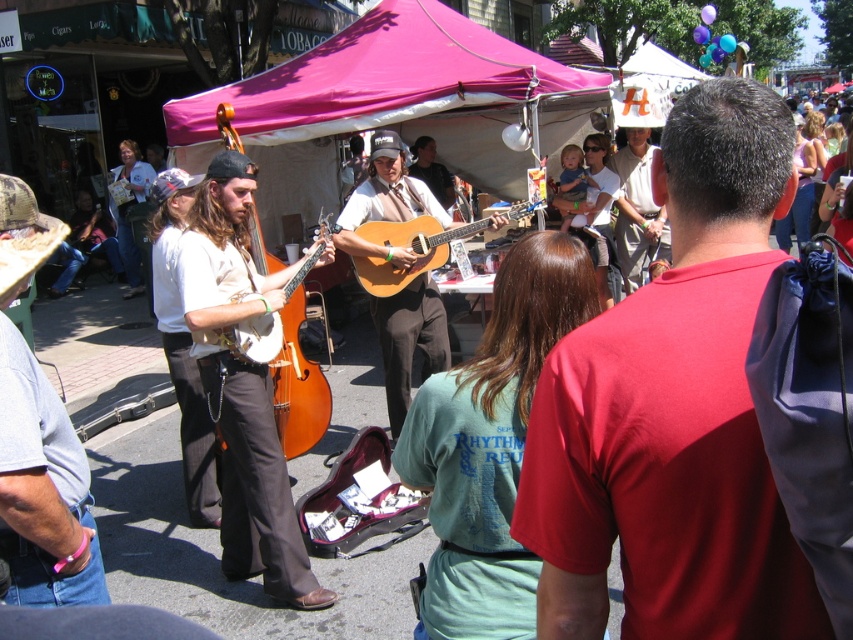
You are a photographer standing in front of the band. You want to take a photo that includes both the light gray cotton shirt at left and the matte brown guitar at center. Which object should you focus on first to ensure both are in frame?

The light gray cotton shirt at left is much taller than the matte brown guitar at center, so you should focus on the light gray cotton shirt at left first to ensure both are in frame.

You are a photographer standing in the middle of the street. You notice a point at coordinate (41, 484) on the light gray cotton shirt at left. If you want to take a photo that includes both the point and the entire pink canopy tent, where should you position your camera relative to the light gray cotton shirt at left?

The point at coordinate (41, 484) is on the light gray cotton shirt at left. To include both the point and the entire pink canopy tent in the photo, position the camera slightly to the right of the light gray cotton shirt at left so that the shirt and the tent are both visible within the frame.

You are a tailor observing the band members in the street scene. You need to determine which of the two cotton shirts, the red cotton shirt at center or the light gray cotton shirt at left, requires more fabric for alterations. Based on their sizes, which shirt should you prioritize?

The light gray cotton shirt at left requires more fabric for alterations because it is larger than the red cotton shirt at center.